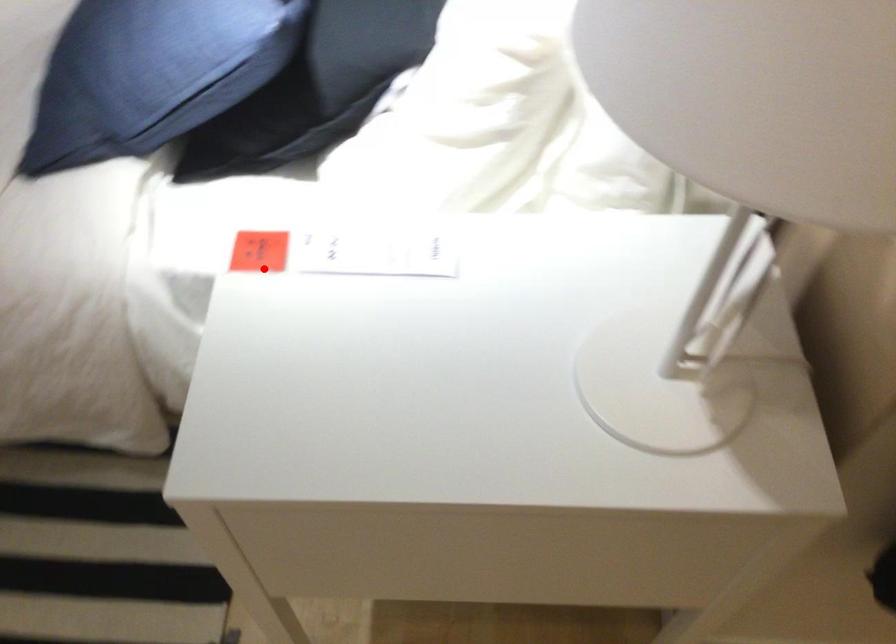
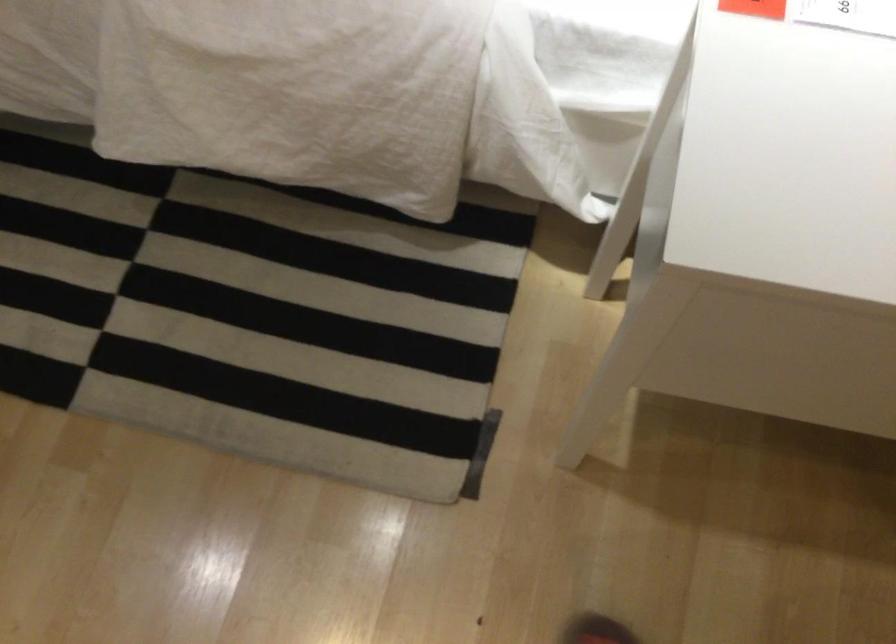
Where in the second image is the point corresponding to the highlighted location from the first image?

(754, 8)